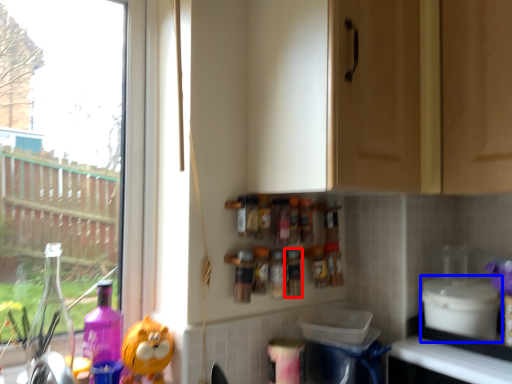
Question: Which of the following is the farthest to the observer, bottle (highlighted by a red box) or appliance (highlighted by a blue box)?

Choices:
 (A) bottle
 (B) appliance

Answer: (A)